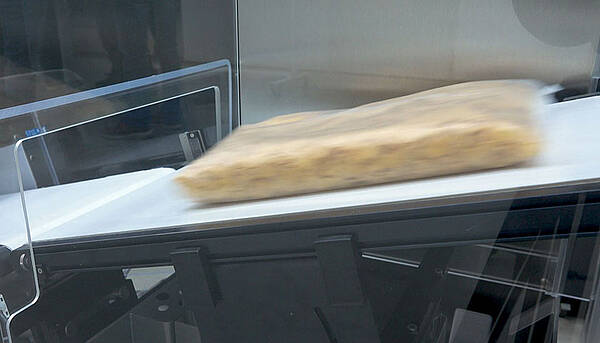
Find the location of a particular element. This screenshot has width=600, height=343. glass is located at coordinates (132, 28), (12, 265), (518, 274).